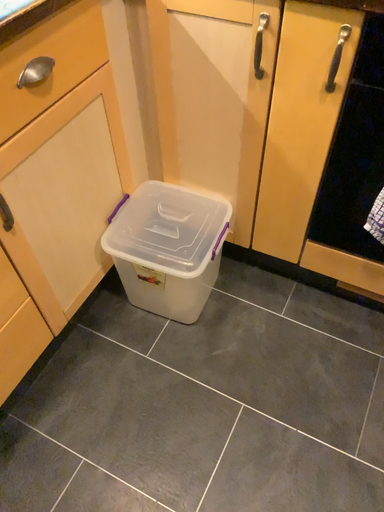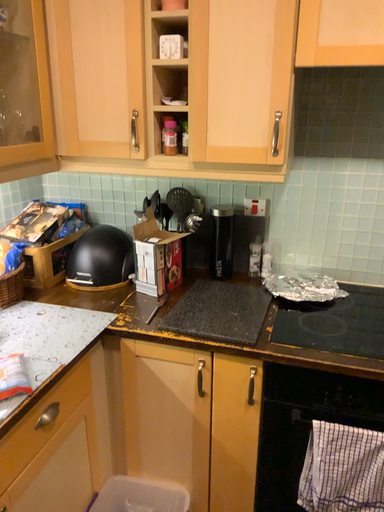
Question: Which way did the camera rotate in the video?

Choices:
 (A) rotated left
 (B) rotated right

Answer: (B)